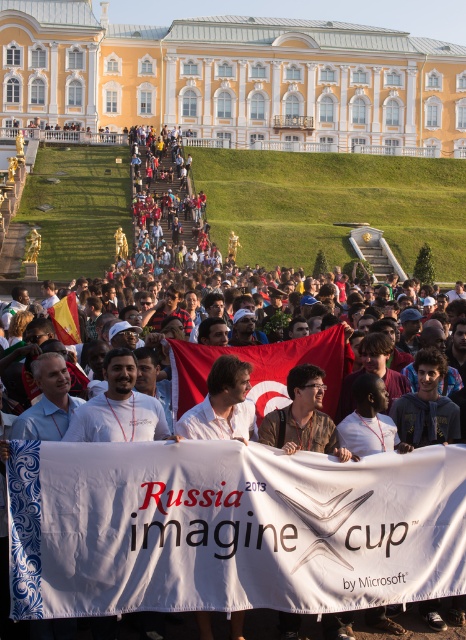
Is yellow/white stone building at upper center taller than yellow fabric flag at center?

Correct, yellow/white stone building at upper center is much taller as yellow fabric flag at center.

You are a GUI agent. You are given a task and a screenshot of the screen. Output one action in this format:
    pyautogui.click(x=<x>, y=<y>)
    Task: Click on the yellow/white stone building at upper center
    The image size is (466, 640).
    Given the screenshot: What is the action you would take?
    pyautogui.click(x=232, y=77)

This screenshot has height=640, width=466. What do you see at coordinates (232, 77) in the screenshot?
I see `yellow/white stone building at upper center` at bounding box center [232, 77].

This screenshot has width=466, height=640. I want to click on yellow/white stone building at upper center, so click(x=232, y=77).

Is yellow/white stone building at upper center to the left of red fabric flag at center from the viewer's perspective?

Incorrect, yellow/white stone building at upper center is not on the left side of red fabric flag at center.

Can you confirm if yellow/white stone building at upper center is thinner than red fabric flag at center?

No.

What do you see at coordinates (232, 77) in the screenshot? I see `yellow/white stone building at upper center` at bounding box center [232, 77].

Locate an element on the screen. The height and width of the screenshot is (640, 466). yellow/white stone building at upper center is located at coordinates (232, 77).

Is red fabric flag at center positioned before yellow fabric flag at center?

That is True.

Between red fabric flag at center and yellow fabric flag at center, which one appears on the right side from the viewer's perspective?

Positioned to the right is red fabric flag at center.

Is point (177, 372) positioned before point (75, 298)?

Yes, point (177, 372) is in front of point (75, 298).

Identify the location of red fabric flag at center. This screenshot has height=640, width=466. (259, 369).